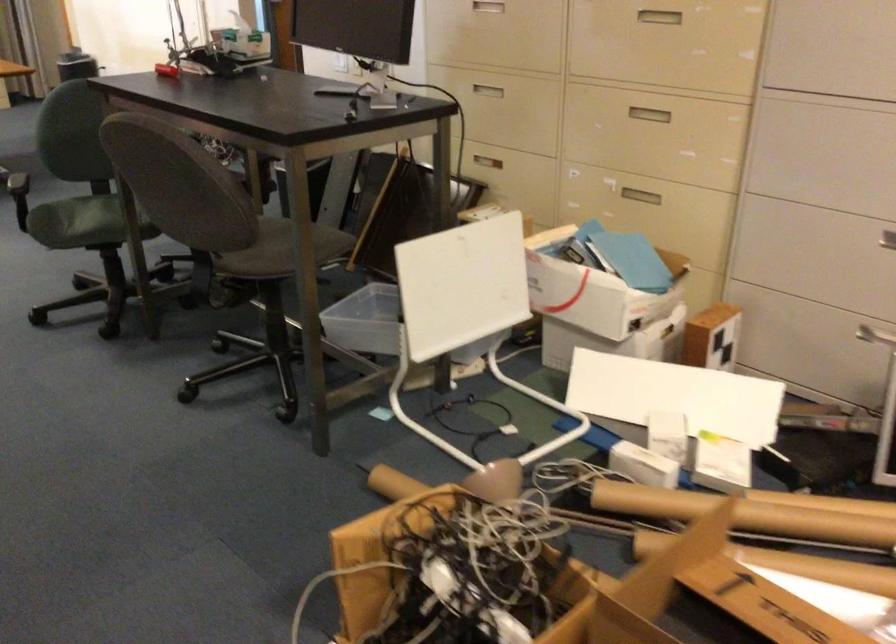
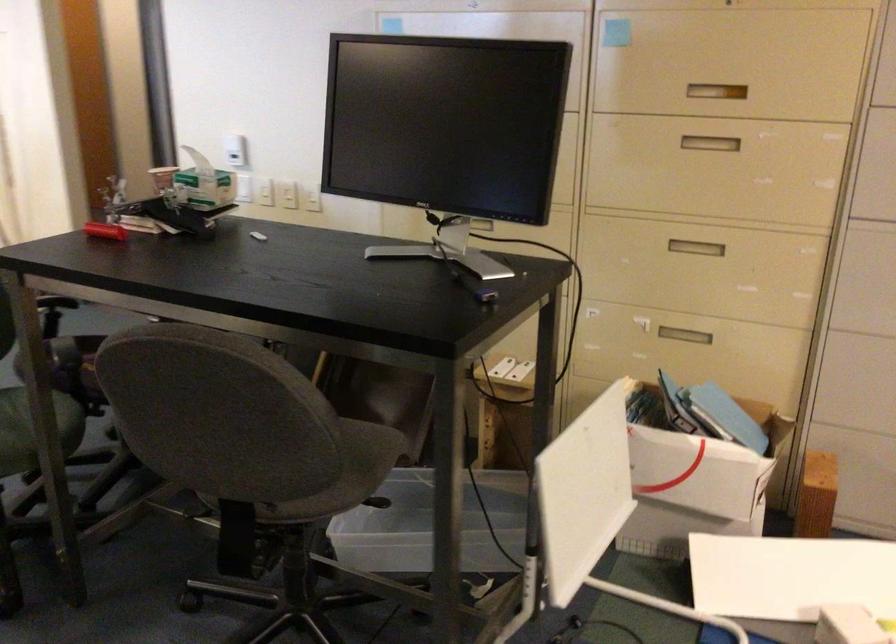
Find the pixel in the second image that matches the point at 636,185 in the first image.

(685, 330)